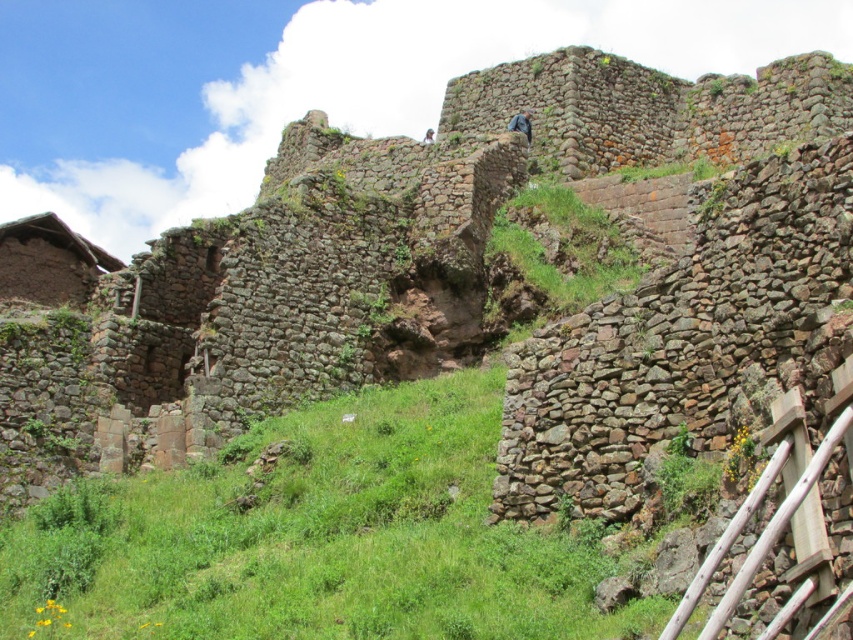
Question: Can you confirm if blue fabric at upper center is wider than blue fabric person at upper center?

Choices:
 (A) no
 (B) yes

Answer: (B)

Question: Can you confirm if green grassy at center is wider than blue fabric person at upper center?

Choices:
 (A) yes
 (B) no

Answer: (A)

Question: Does blue fabric at upper center have a larger size compared to blue fabric person at upper center?

Choices:
 (A) no
 (B) yes

Answer: (A)

Question: Which object is positioned closest to the green grassy at center?

Choices:
 (A) blue fabric person at upper center
 (B) blue fabric at upper center

Answer: (B)

Question: Based on their relative distances, which object is farther from the green grassy at center?

Choices:
 (A) blue fabric at upper center
 (B) blue fabric person at upper center

Answer: (B)

Question: Which of the following is the farthest from the observer?

Choices:
 (A) (430, 132)
 (B) (480, 580)

Answer: (A)